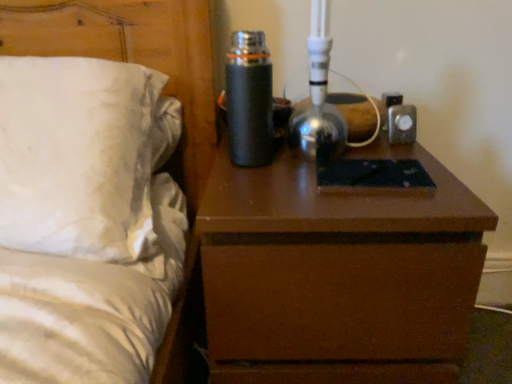
Question: Considering the relative positions of white satin bed at left and brown matte nightstand at center in the image provided, is white satin bed at left to the left or to the right of brown matte nightstand at center?

Choices:
 (A) left
 (B) right

Answer: (A)

Question: Is point (211, 56) positioned closer to the camera than point (362, 283)?

Choices:
 (A) farther
 (B) closer

Answer: (A)

Question: Which of these objects is positioned closest to the black matte thermos at upper center?

Choices:
 (A) white satin bed at left
 (B) brown matte nightstand at center

Answer: (B)

Question: Estimate the real-world distances between objects in this image. Which object is farther from the white satin bed at left?

Choices:
 (A) black matte thermos at upper center
 (B) brown matte nightstand at center

Answer: (B)